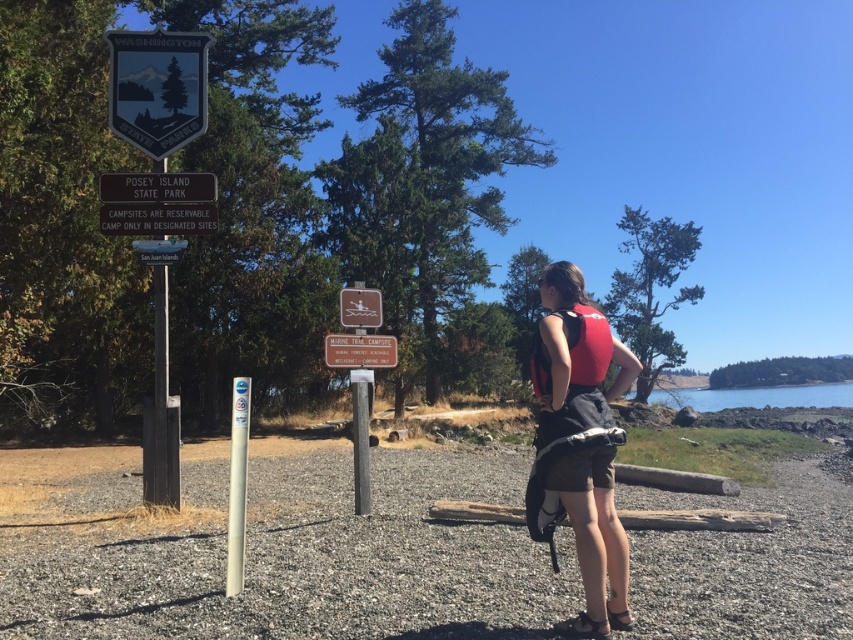
Between metallic blue sign at upper center and metallic silver boat at center, which one has less height?

Standing shorter between the two is metallic silver boat at center.

Can you confirm if metallic blue sign at upper center is bigger than metallic silver boat at center?

Indeed, metallic blue sign at upper center has a larger size compared to metallic silver boat at center.

The width and height of the screenshot is (853, 640). What do you see at coordinates (157, 88) in the screenshot?
I see `metallic blue sign at upper center` at bounding box center [157, 88].

At what (x,y) coordinates should I click in order to perform the action: click on metallic blue sign at upper center. Please return your answer as a coordinate pair (x, y). Looking at the image, I should click on (157, 88).

Who is taller, matte red life vest at center or metallic silver boat at center?

Standing taller between the two is matte red life vest at center.

From the picture: Who is shorter, matte red life vest at center or metallic silver boat at center?

With less height is metallic silver boat at center.

At what (x,y) coordinates should I click in order to perform the action: click on matte red life vest at center. Please return your answer as a coordinate pair (x, y). The width and height of the screenshot is (853, 640). Looking at the image, I should click on (590, 348).

Which is behind, point (587, 624) or point (183, 100)?

Point (183, 100)

Identify the location of red matte vest at center. Image resolution: width=853 pixels, height=640 pixels. (582, 440).